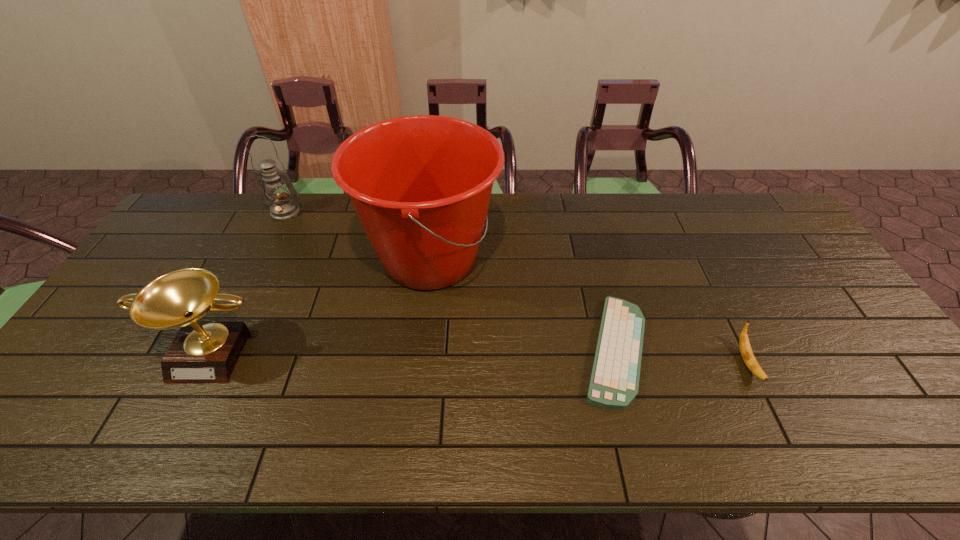
The image size is (960, 540). I want to click on the third object from left to right, so click(421, 185).

Where is `bucket`? This screenshot has height=540, width=960. bucket is located at coordinates (421, 185).

Identify the location of the fourth shortest object. (282, 208).

Where is `award`? award is located at coordinates (202, 352).

Identify the location of banana. Image resolution: width=960 pixels, height=540 pixels. (749, 359).

Identify the location of the rightmost object. (749, 359).

Locate an element on the screen. The image size is (960, 540). computer keyboard is located at coordinates (614, 382).

Identify the location of the second object from right to left. Image resolution: width=960 pixels, height=540 pixels. (614, 382).

Locate an element on the screen. vacant space located 0.140m with the handle attached to the rim of the tallest object is located at coordinates (545, 260).

Locate an element on the screen. vacant space located 0.050m on the front of the oil lamp is located at coordinates point(276,231).